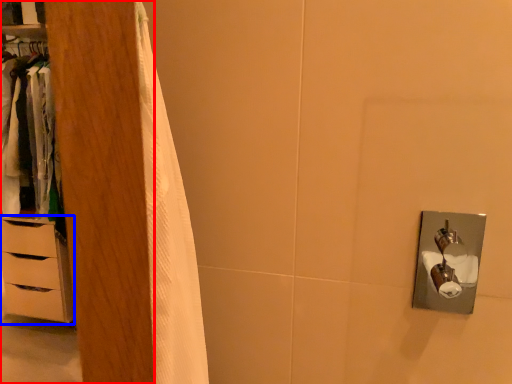
Question: Which object is closer to the camera taking this photo, armoire (highlighted by a red box) or chest of drawers (highlighted by a blue box)?

Choices:
 (A) armoire
 (B) chest of drawers

Answer: (A)